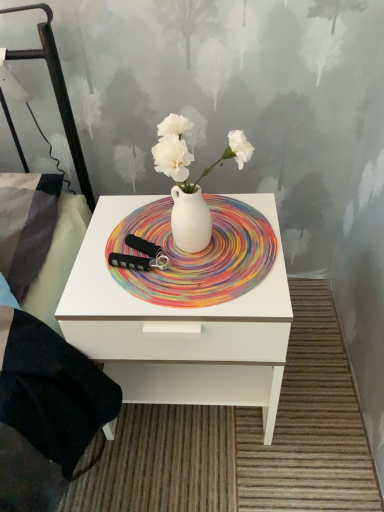
Find the location of a particular element. This screenshot has width=384, height=512. free space above white matte plate at center (from a real-world perspective) is located at coordinates pos(185,245).